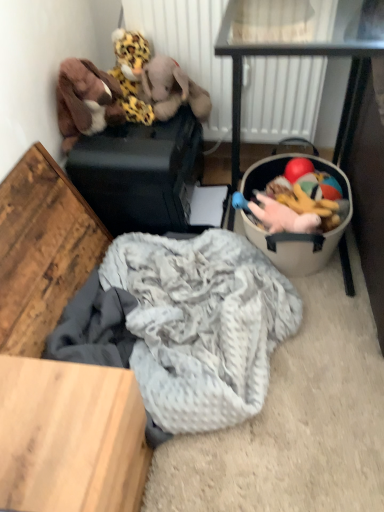
Locate an element on the screen. This screenshot has height=512, width=384. wooden table at lower left is located at coordinates (70, 437).

This screenshot has width=384, height=512. What do you see at coordinates (70, 437) in the screenshot?
I see `wooden table at lower left` at bounding box center [70, 437].

Describe the element at coordinates (131, 73) in the screenshot. The width and height of the screenshot is (384, 512). I see `fluffy leopard print plush at upper left, the first toy when ordered from top to bottom` at that location.

This screenshot has width=384, height=512. Identify the location of white textured radiator at upper center. (288, 100).

Describe the element at coordinates (296, 208) in the screenshot. I see `fluffy plush toys at right` at that location.

Image resolution: width=384 pixels, height=512 pixels. What are the coordinates of `wooden table at lower left` in the screenshot? It's located at (70, 437).

Is wooden table at lower left next to white textured radiator at upper center and touching it?

No.

Is wooden table at lower left facing away from white textured radiator at upper center?

wooden table at lower left is not turned away from white textured radiator at upper center.

From a real-world perspective, is wooden table at lower left located higher than white textured radiator at upper center?

Actually, wooden table at lower left is physically below white textured radiator at upper center in the real world.

Does point (21, 298) appear closer or farther from the camera than point (302, 133)?

Point (21, 298) is closer to the camera than point (302, 133).

Based on the photo, how many degrees apart are the facing directions of soft gray knit blanket at lower center and metallic black table at right?

89.9 degrees.

From the image's perspective, would you say soft gray knit blanket at lower center is shown under metallic black table at right?

Yes.

Is soft gray knit blanket at lower center at the left side of metallic black table at right?

Indeed, soft gray knit blanket at lower center is positioned on the left side of metallic black table at right.

Is there a large distance between soft gray knit blanket at lower center and metallic black table at right?

That's not correct — soft gray knit blanket at lower center is a little close to metallic black table at right.

Locate an element on the screen. This screenshot has height=512, width=384. animal located above the metallic black table at right (from a real-world perspective) is located at coordinates (172, 89).

Is metallic black table at right aimed at brown plush elephant at upper left?

No.

Are metallic black table at right and brown plush elephant at upper left making contact?

metallic black table at right and brown plush elephant at upper left are not in contact.

Is metallic black table at right shorter than brown plush elephant at upper left?

Incorrect, the height of metallic black table at right does not fall short of that of brown plush elephant at upper left.

How different are the orientations of metallic black table at right and fluffy leopard print plush at upper left, the first toy when ordered from top to bottom, in degrees?

The facing directions of metallic black table at right and fluffy leopard print plush at upper left, the first toy when ordered from top to bottom, are 2.11 degrees apart.

Is metallic black table at right not near fluffy leopard print plush at upper left, the first toy when ordered from top to bottom?

That's not correct — metallic black table at right is a little close to fluffy leopard print plush at upper left, the first toy when ordered from top to bottom.

Is metallic black table at right oriented away from fluffy leopard print plush at upper left, placed as the second toy when sorted from bottom to top?

metallic black table at right is not turned away from fluffy leopard print plush at upper left, placed as the second toy when sorted from bottom to top.

Consider the image. Which is behind, metallic black table at right or fluffy leopard print plush at upper left, placed as the second toy when sorted from bottom to top?

fluffy leopard print plush at upper left, placed as the second toy when sorted from bottom to top, is further from the camera.

From a real-world perspective, between brown plush elephant at upper left and fluffy plush toys at right, who is vertically higher?

In real-world perspective, brown plush elephant at upper left is above.

Which of these two, brown plush elephant at upper left or fluffy plush toys at right, is thinner?

fluffy plush toys at right is thinner.

Considering the positions of objects brown plush elephant at upper left and fluffy plush toys at right in the image provided, who is in front, brown plush elephant at upper left or fluffy plush toys at right?

fluffy plush toys at right is closer to the camera.

Find the location of a particular element. This screenshot has width=384, height=512. stuff in front of the brown plush elephant at upper left is located at coordinates (x=296, y=208).

From a real-world perspective, is soft gray knit blanket at lower center physically above wooden table at lower left?

No, from a real-world perspective, soft gray knit blanket at lower center is not above wooden table at lower left.

Based on the photo, who is more distant, soft gray knit blanket at lower center or wooden table at lower left?

soft gray knit blanket at lower center is more distant.

Is soft gray knit blanket at lower center taller or shorter than wooden table at lower left?

In the image, soft gray knit blanket at lower center appears to be shorter than wooden table at lower left.

Locate an element on the screen. The image size is (384, 512). blanket to the right of wooden table at lower left is located at coordinates (201, 324).

Is wooden table at lower left located within white textured radiator at upper center?

No, wooden table at lower left is located outside of white textured radiator at upper center.

Based on their positions, is white textured radiator at upper center located to the left or right of wooden table at lower left?

Clearly, white textured radiator at upper center is on the right of wooden table at lower left in the image.

Measure the distance between white textured radiator at upper center and wooden table at lower left.

white textured radiator at upper center and wooden table at lower left are 28.86 inches apart.

From a real-world perspective, is white textured radiator at upper center on wooden table at lower left?

Correct, in the physical world, white textured radiator at upper center is higher than wooden table at lower left.

This screenshot has width=384, height=512. Identify the location of radiator located behind the wooden table at lower left. (288, 100).

Locate an element on the screen. blanket located on the left of metallic black table at right is located at coordinates (201, 324).

Considering their positions, is brown plush elephant at upper left positioned further to fluffy leopard print plush at upper left, placed as the second toy when sorted from bottom to top, than wooden table at lower left?

Answer: Based on the image, wooden table at lower left appears to be further to fluffy leopard print plush at upper left, placed as the second toy when sorted from bottom to top.

Consider the image. Looking at the image, which one is located closer to brown plush elephant at upper left, brown plush toy at upper left, acting as the 1th toy starting from the bottom, or metallic black table at right?

Based on the image, brown plush toy at upper left, acting as the 1th toy starting from the bottom, appears to be nearer to brown plush elephant at upper left.

Based on their spatial positions, is fluffy plush toys at right or brown plush toy at upper left, marked as the 2th toy in a top-to-bottom arrangement, further from brown plush elephant at upper left?

fluffy plush toys at right is further to brown plush elephant at upper left.

Which object lies nearer to the anchor point brown plush elephant at upper left, metallic black table at right or fluffy plush toys at right?

Based on the image, metallic black table at right appears to be nearer to brown plush elephant at upper left.

Estimate the real-world distances between objects in this image. Which object is further from brown plush elephant at upper left, brown plush toy at upper left, marked as the 2th toy in a top-to-bottom arrangement, or soft gray knit blanket at lower center?

soft gray knit blanket at lower center lies further to brown plush elephant at upper left than the other object.

When comparing their distances from brown plush toy at upper left, acting as the 1th toy starting from the bottom, does metallic black table at right or soft gray knit blanket at lower center seem further?

soft gray knit blanket at lower center is further to brown plush toy at upper left, acting as the 1th toy starting from the bottom.

Looking at the image, which one is located closer to white textured radiator at upper center, metallic black table at right or fluffy leopard print plush at upper left, the first toy when ordered from top to bottom?

metallic black table at right is closer to white textured radiator at upper center.

When comparing their distances from soft gray knit blanket at lower center, does wooden table at lower left or fluffy leopard print plush at upper left, the first toy when ordered from top to bottom, seem closer?

wooden table at lower left.

This screenshot has width=384, height=512. I want to click on animal that lies between white textured radiator at upper center and soft gray knit blanket at lower center from top to bottom, so click(x=172, y=89).

Image resolution: width=384 pixels, height=512 pixels. In order to click on radiator between brown plush toy at upper left, marked as the 2th toy in a top-to-bottom arrangement, and metallic black table at right, in the horizontal direction in this screenshot , I will do `click(288, 100)`.

The image size is (384, 512). I want to click on blanket located between wooden table at lower left and fluffy plush toys at right in the left-right direction, so click(x=201, y=324).

This screenshot has height=512, width=384. I want to click on toy situated between brown plush toy at upper left, acting as the 1th toy starting from the bottom, and white textured radiator at upper center from left to right, so click(131, 73).